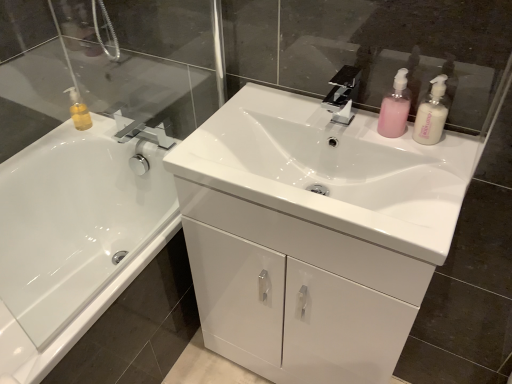
Locate an element on the screen. This screenshot has width=512, height=384. vacant space to the left of pink matte pump bottle at upper right, which is the 2th toiletry in right-to-left order is located at coordinates (337, 134).